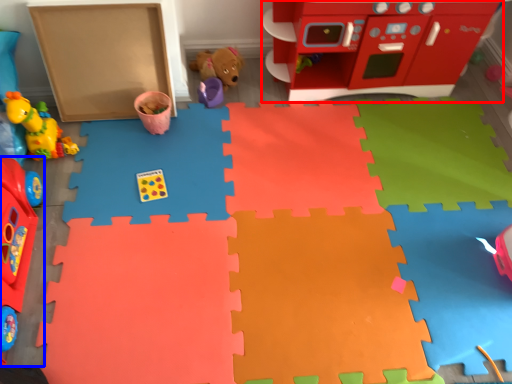
Question: Which of the following is the closest to the observer, toy (highlighted by a red box) or toy (highlighted by a blue box)?

Choices:
 (A) toy
 (B) toy

Answer: (B)